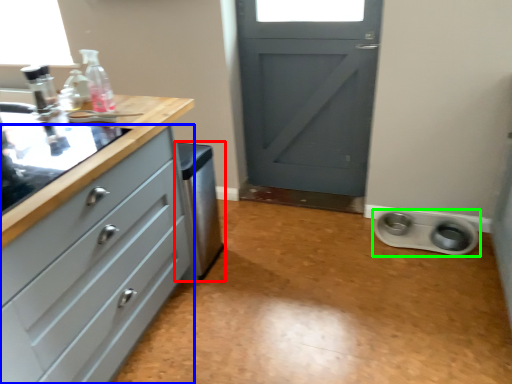
Question: Which object is the farthest from dish washer (highlighted by a red box)? Choose among these: chest of drawers (highlighted by a blue box) or appliance (highlighted by a green box).

Choices:
 (A) chest of drawers
 (B) appliance

Answer: (B)